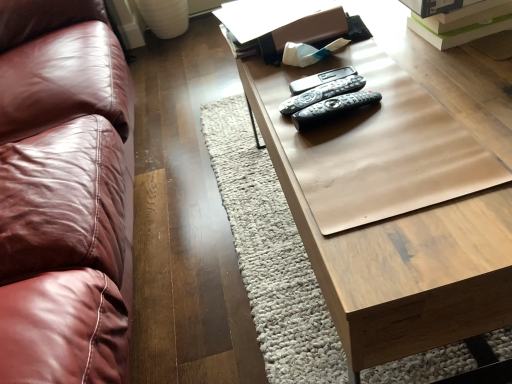
Question: In the image, is black plastic remotes at center, which appears as the first remote when viewed from the front, on the left side or the right side of black plastic remote at center, the third remote from the front?

Choices:
 (A) left
 (B) right

Answer: (B)

Question: Looking at the image, does black plastic remotes at center, acting as the third remote starting from the back, seem bigger or smaller compared to black plastic remote at center, acting as the first remote starting from the back?

Choices:
 (A) small
 (B) big

Answer: (B)

Question: Which object is the farthest from the black plastic remotes at center, acting as the third remote starting from the back?

Choices:
 (A) black plastic remotes at center, arranged as the 2th remote when viewed from the back
 (B) wooden table at center
 (C) black plastic remote at center, the third remote from the front

Answer: (B)

Question: Estimate the real-world distances between objects in this image. Which object is farther from the wooden table at center?

Choices:
 (A) black plastic remotes at center, which appears as the first remote when viewed from the front
 (B) black plastic remotes at center, arranged as the 2th remote when viewed from the back
 (C) black plastic remote at center, the third remote from the front

Answer: (C)